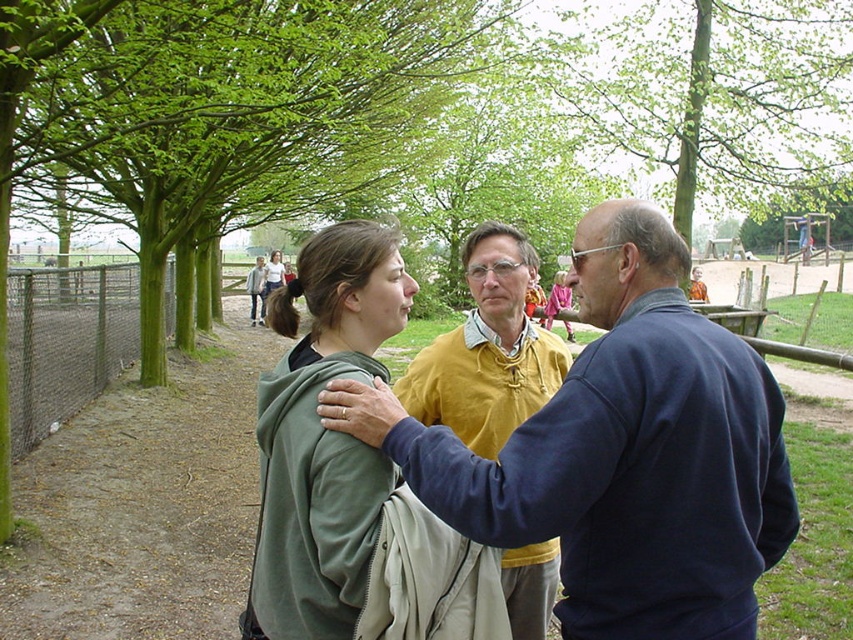
Can you confirm if white cotton shirt at center is taller than matte yellow sweater at center?

Yes.

How distant is white cotton shirt at center from matte yellow sweater at center?

They are 5.31 inches apart.

At what (x,y) coordinates should I click in order to perform the action: click on white cotton shirt at center. Please return your answer as a coordinate pair (x, y). Looking at the image, I should click on (263, 284).

Who is positioned more to the right, yellow knit sweater at center or matte yellow sweater at center?

yellow knit sweater at center is more to the right.

Is point (476, 260) positioned before point (256, 268)?

That is True.

Is point (483, 230) closer to viewer compared to point (248, 289)?

That is True.

In order to click on yellow knit sweater at center in this screenshot , I will do `click(486, 349)`.

Who is positioned more to the left, chain-link fence at left or matte yellow sweater at center?

matte yellow sweater at center is more to the left.

Is point (115, 362) farther from camera compared to point (258, 266)?

No, it is not.

Identify the location of chain-link fence at left. This screenshot has height=640, width=853. (67, 340).